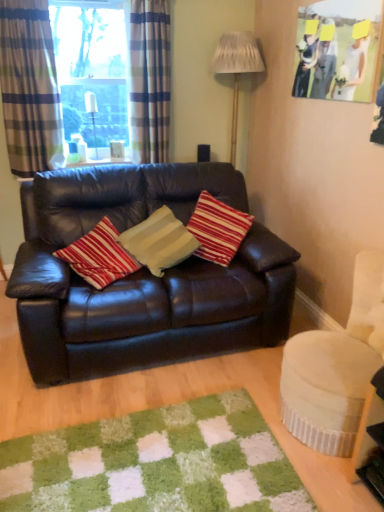
Question: From the image's perspective, is clear glass window at upper left on top of matte paper picture frame at upper right?

Choices:
 (A) yes
 (B) no

Answer: (A)

Question: Considering the relative sizes of clear glass window at upper left and matte paper picture frame at upper right in the image provided, is clear glass window at upper left bigger than matte paper picture frame at upper right?

Choices:
 (A) no
 (B) yes

Answer: (B)

Question: Considering the relative positions of clear glass window at upper left and matte paper picture frame at upper right in the image provided, is clear glass window at upper left to the left of matte paper picture frame at upper right from the viewer's perspective?

Choices:
 (A) no
 (B) yes

Answer: (B)

Question: Can you see clear glass window at upper left touching matte paper picture frame at upper right?

Choices:
 (A) no
 (B) yes

Answer: (A)

Question: From a real-world perspective, does clear glass window at upper left sit lower than matte paper picture frame at upper right?

Choices:
 (A) yes
 (B) no

Answer: (A)

Question: Can you confirm if clear glass window at upper left is wider than matte paper picture frame at upper right?

Choices:
 (A) no
 (B) yes

Answer: (B)

Question: Is clear glass bottle at upper left, which is the second lamp from right to left, bigger than shiny brown leather couch at center?

Choices:
 (A) yes
 (B) no

Answer: (B)

Question: Does clear glass bottle at upper left, which is the second lamp from right to left, have a lesser width compared to shiny brown leather couch at center?

Choices:
 (A) yes
 (B) no

Answer: (A)

Question: Considering the relative sizes of clear glass bottle at upper left, which is the second lamp from right to left, and shiny brown leather couch at center in the image provided, is clear glass bottle at upper left, which is the second lamp from right to left, shorter than shiny brown leather couch at center?

Choices:
 (A) no
 (B) yes

Answer: (B)

Question: Is clear glass bottle at upper left, marked as the first lamp in a left-to-right arrangement, taller than shiny brown leather couch at center?

Choices:
 (A) no
 (B) yes

Answer: (A)

Question: Is shiny brown leather couch at center a part of clear glass bottle at upper left, marked as the first lamp in a left-to-right arrangement?

Choices:
 (A) yes
 (B) no

Answer: (B)

Question: Is clear glass bottle at upper left, marked as the first lamp in a left-to-right arrangement, further to camera compared to shiny brown leather couch at center?

Choices:
 (A) yes
 (B) no

Answer: (A)

Question: Is plaid fabric curtain at upper left, positioned as the first curtain in right-to-left order, smaller than shiny brown leather couch at center?

Choices:
 (A) no
 (B) yes

Answer: (B)